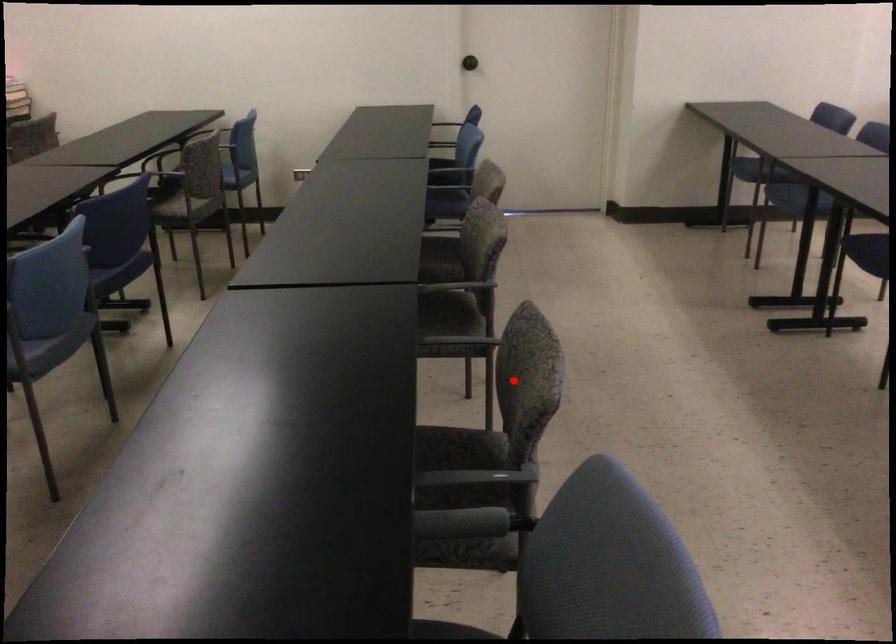
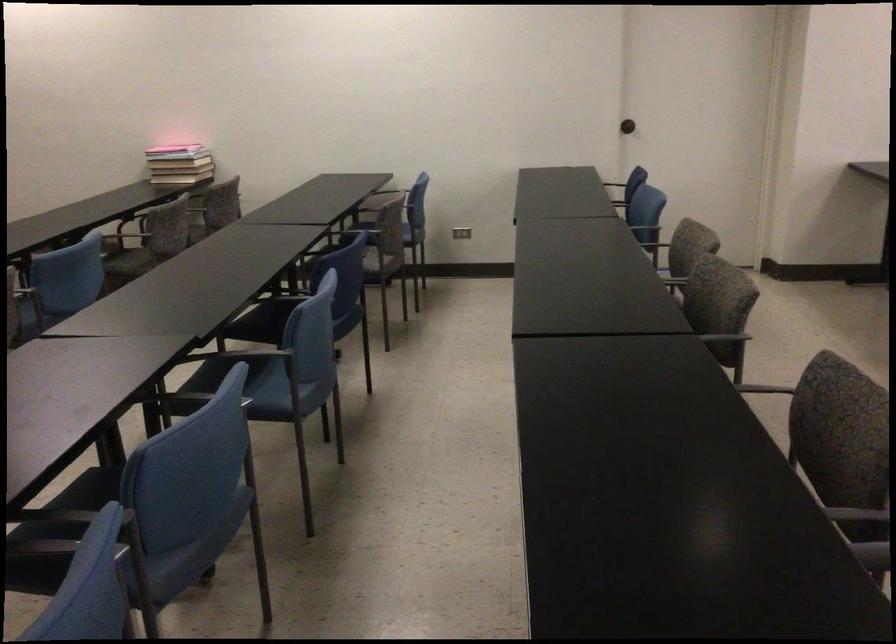
Locate, in the second image, the point that corresponds to the highlighted location in the first image.

(837, 421)